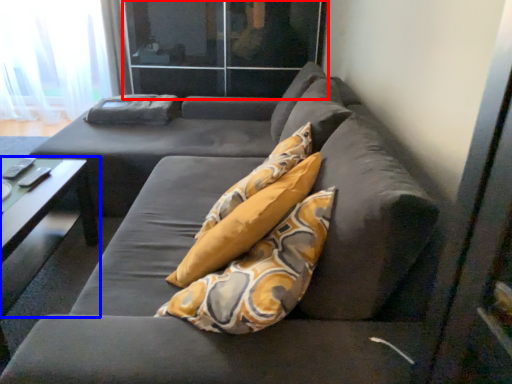
Question: Which point is closer to the camera, glass door (highlighted by a red box) or table (highlighted by a blue box)?

Choices:
 (A) glass door
 (B) table

Answer: (B)